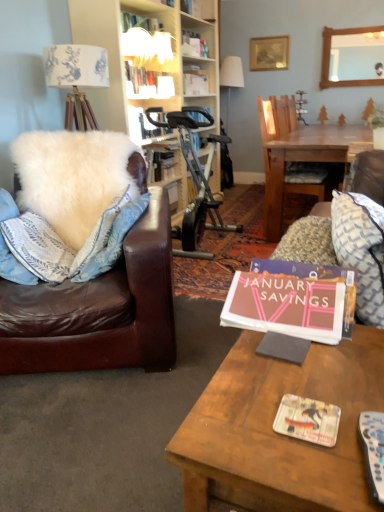
Find the location of a particular element. The height and width of the screenshot is (512, 384). vacant space behind matte paper magazine at center is located at coordinates (301, 368).